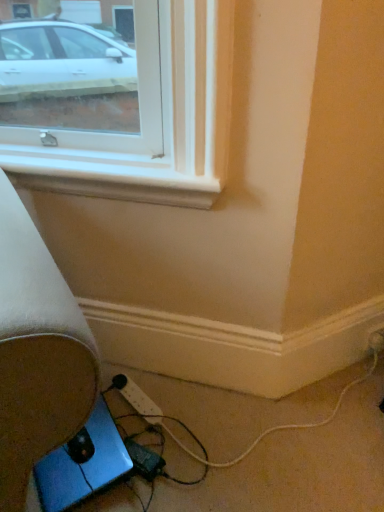
Question: Can you confirm if blue metallic laptop at lower left is thinner than white plastic power strip at lower right?

Choices:
 (A) yes
 (B) no

Answer: (B)

Question: Is blue metallic laptop at lower left at the left side of white plastic power strip at lower right?

Choices:
 (A) no
 (B) yes

Answer: (B)

Question: Is blue metallic laptop at lower left positioned in front of white plastic power strip at lower right?

Choices:
 (A) no
 (B) yes

Answer: (B)

Question: Would you say blue metallic laptop at lower left contains white plastic power strip at lower right?

Choices:
 (A) no
 (B) yes

Answer: (A)

Question: Does blue metallic laptop at lower left touch white plastic power strip at lower right?

Choices:
 (A) no
 (B) yes

Answer: (A)

Question: Considering their positions, is white plastic power strip at lower right located in front of or behind black plastic extension cord at lower center, which appears as the 2th extension cord when viewed from the back?

Choices:
 (A) behind
 (B) front

Answer: (A)

Question: From their relative heights in the image, would you say white plastic power strip at lower right is taller or shorter than black plastic extension cord at lower center, which appears as the 2th extension cord when viewed from the back?

Choices:
 (A) tall
 (B) short

Answer: (A)

Question: Considering the relative positions of white plastic power strip at lower right and black plastic extension cord at lower center, which is counted as the 1th extension cord, starting from the front, in the image provided, is white plastic power strip at lower right to the left or to the right of black plastic extension cord at lower center, which is counted as the 1th extension cord, starting from the front,?

Choices:
 (A) right
 (B) left

Answer: (A)

Question: Is white plastic power strip at lower right spatially inside black plastic extension cord at lower center, which is counted as the 1th extension cord, starting from the front, or outside of it?

Choices:
 (A) inside
 (B) outside

Answer: (B)

Question: Is blue metallic laptop at lower left taller or shorter than white plastic power strip at lower center, the 1th extension cord from the back?

Choices:
 (A) short
 (B) tall

Answer: (B)

Question: Would you say blue metallic laptop at lower left is to the left or to the right of white plastic power strip at lower center, the 1th extension cord from the back, in the picture?

Choices:
 (A) left
 (B) right

Answer: (A)

Question: Is blue metallic laptop at lower left inside or outside of white plastic power strip at lower center, the second extension cord positioned from the front?

Choices:
 (A) outside
 (B) inside

Answer: (A)

Question: Considering the positions of point (46, 470) and point (137, 400), is point (46, 470) closer or farther from the camera than point (137, 400)?

Choices:
 (A) farther
 (B) closer

Answer: (B)

Question: Does point (137, 400) appear closer or farther from the camera than point (380, 342)?

Choices:
 (A) farther
 (B) closer

Answer: (B)

Question: In terms of size, does white plastic power strip at lower center, the second extension cord positioned from the front, appear bigger or smaller than white plastic power strip at lower right?

Choices:
 (A) small
 (B) big

Answer: (B)